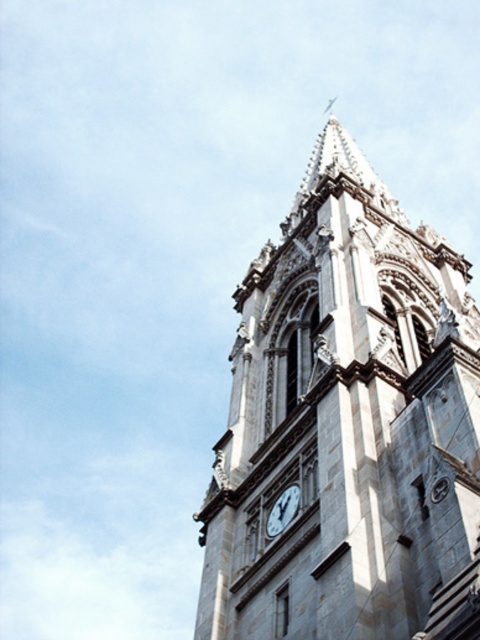
Question: Can you confirm if white stone clock tower at center is positioned to the right of white marble clock at center?

Choices:
 (A) yes
 (B) no

Answer: (A)

Question: Among these objects, which one is nearest to the camera?

Choices:
 (A) white marble clock at center
 (B) white stone clock tower at center

Answer: (B)

Question: Is white stone clock tower at center positioned before white marble clock at center?

Choices:
 (A) no
 (B) yes

Answer: (B)

Question: Which object is closer to the camera taking this photo?

Choices:
 (A) white stone clock tower at center
 (B) white marble clock at center

Answer: (A)

Question: Which point is closer to the camera?

Choices:
 (A) (298, 493)
 (B) (402, 243)

Answer: (A)

Question: In this image, where is white stone clock tower at center located relative to white marble clock at center?

Choices:
 (A) left
 (B) right

Answer: (B)